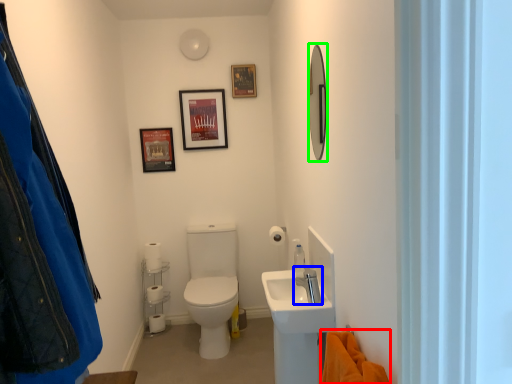
Question: Which object is the closest to the blanket (highlighted by a red box)? Choose among these: tap (highlighted by a blue box) or mirror (highlighted by a green box).

Choices:
 (A) tap
 (B) mirror

Answer: (A)